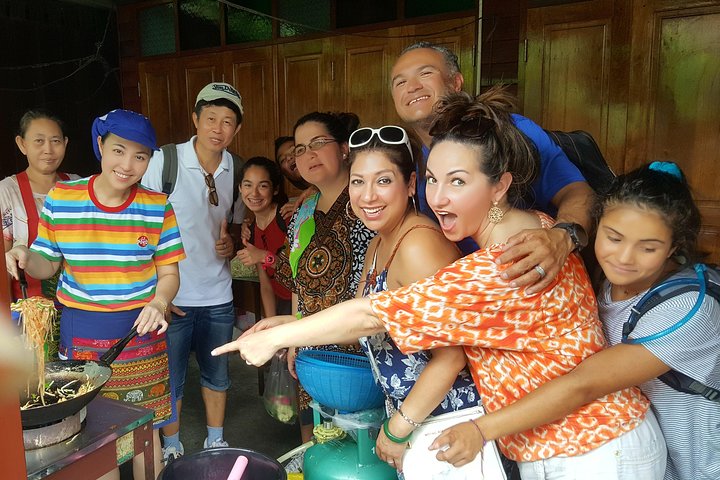
Find the location of a particular element. Image resolution: width=720 pixels, height=480 pixels. table is located at coordinates (116, 421).